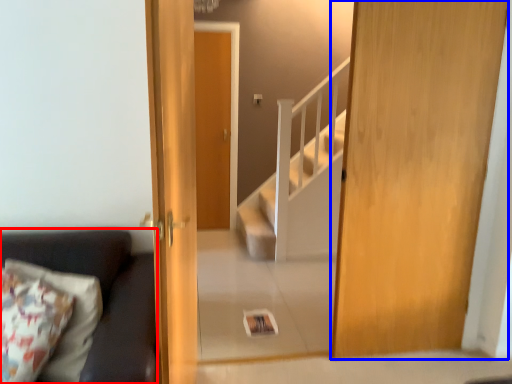
Question: Which object appears farthest to the camera in this image, studio couch (highlighted by a red box) or door (highlighted by a blue box)?

Choices:
 (A) studio couch
 (B) door

Answer: (B)